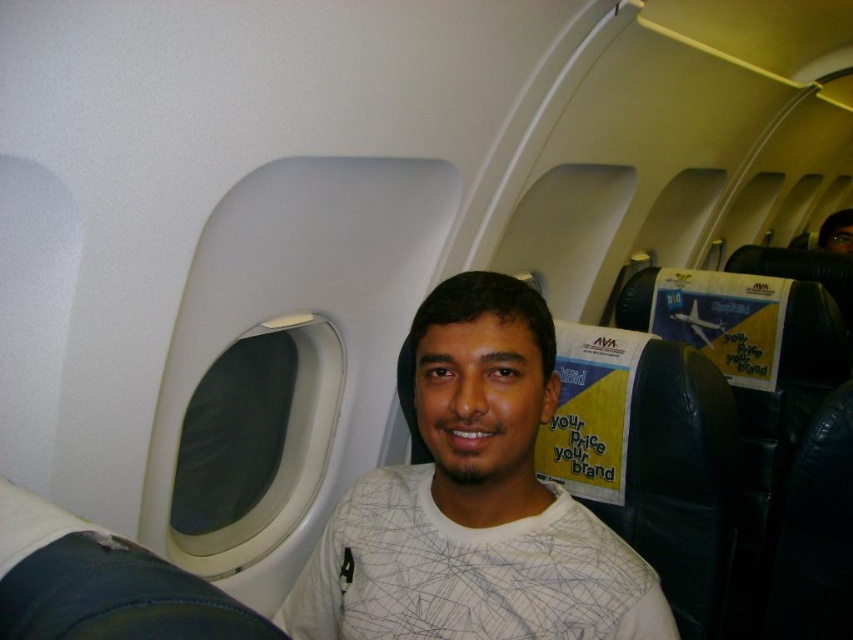
You are a flight attendant checking the seating arrangement in the airplane cabin. You need to locate the white matte shirt at center. Where exactly is it positioned in terms of coordinates?

The white matte shirt at center is located at the 2D coordinates point (x=474, y=502).

You are a flight attendant checking the cabin. You notice the white matte shirt at center and the metallic airplane at upper right. Which object is located lower in the image?

The white matte shirt at center is positioned under the metallic airplane at upper right, so it is located lower in the image.

You are sitting in the airplane cabin and want to reach a point behind you. Which of the two points, point [563,573] or point [260,636], is located behind you?

Point [563,573] is behind point [260,636], so if you are sitting at point [260,636], then point [563,573] is behind you.